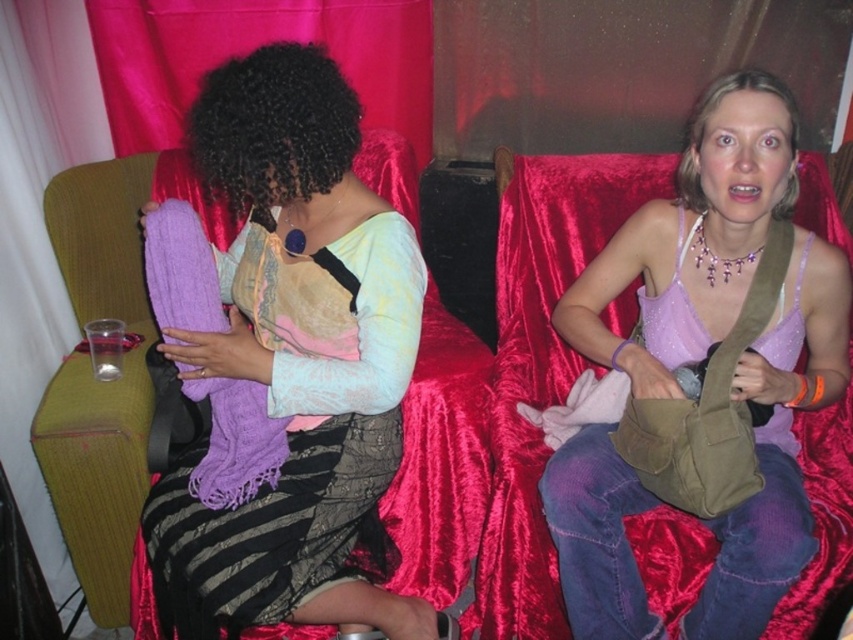
You are standing at a point 1.35 meters away from the camera. If you walk straight towards the camera, will you reach the point labeled as point (314,51) before covering 1.35 meters?

Yes, because the distance between point (314,51) and the camera is exactly 1.35 meters. If you walk straight towards the camera from your current position, you will reach point (314,51) precisely after walking 1.35 meters.

Based on the photo, you are organizing a fashion show and need to display two scarves. The matte purple scarf at left and the purple soft scarf at center are available. Which scarf should you choose if you want the larger one for a closeup shot?

The matte purple scarf at left is larger in size compared to the purple soft scarf at center, so it would be the better choice for a closeup shot to showcase its details.